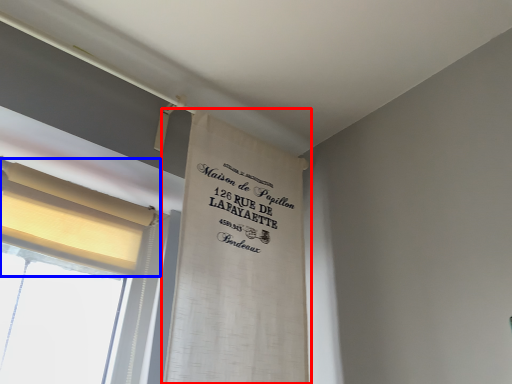
Question: Which object appears farthest to the camera in this image, curtain (highlighted by a red box) or curtain (highlighted by a blue box)?

Choices:
 (A) curtain
 (B) curtain

Answer: (B)